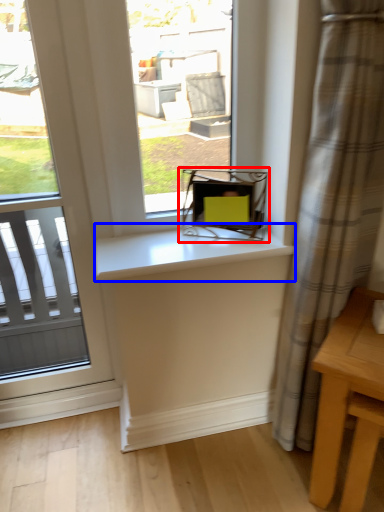
Question: Which of the following is the closest to the observer, chair (highlighted by a red box) or counter top (highlighted by a blue box)?

Choices:
 (A) chair
 (B) counter top

Answer: (B)